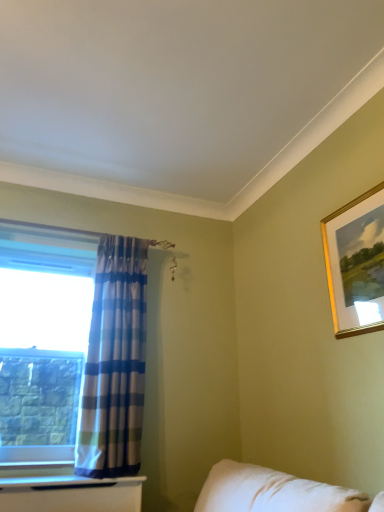
What do you see at coordinates (356, 263) in the screenshot?
I see `gold-framed picture at upper right` at bounding box center [356, 263].

Locate an element on the screen. Image resolution: width=384 pixels, height=512 pixels. clear glass window at left is located at coordinates (72, 348).

What is the approximate width of clear glass window at left?

The width of clear glass window at left is 6.29 inches.

Identify the location of blue plaid fabric curtain at left. (114, 362).

Considering the relative sizes of gold-framed picture at upper right and blue plaid fabric curtain at left in the image provided, is gold-framed picture at upper right smaller than blue plaid fabric curtain at left?

Correct, gold-framed picture at upper right occupies less space than blue plaid fabric curtain at left.

How distant is gold-framed picture at upper right from blue plaid fabric curtain at left?

The distance of gold-framed picture at upper right from blue plaid fabric curtain at left is 3.97 feet.

Is blue plaid fabric curtain at left located within gold-framed picture at upper right?

No, blue plaid fabric curtain at left is not surrounded by gold-framed picture at upper right.

Is the position of blue plaid fabric curtain at left more distant than that of gold-framed picture at upper right?

Yes.

Does blue plaid fabric curtain at left have a greater height compared to gold-framed picture at upper right?

Yes, blue plaid fabric curtain at left is taller than gold-framed picture at upper right.

Can you tell me how much blue plaid fabric curtain at left and gold-framed picture at upper right differ in facing direction?

The angle between the facing direction of blue plaid fabric curtain at left and the facing direction of gold-framed picture at upper right is 90.6 degrees.

From the image's perspective, does blue plaid fabric curtain at left appear lower than gold-framed picture at upper right?

Indeed, from the image's perspective, blue plaid fabric curtain at left is shown beneath gold-framed picture at upper right.

Can clear glass window at left be found inside gold-framed picture at upper right?

No, clear glass window at left is not inside gold-framed picture at upper right.

Consider the image. Is clear glass window at left at the back of gold-framed picture at upper right?

No, clear glass window at left is not at the back of gold-framed picture at upper right.

Would you consider gold-framed picture at upper right to be distant from clear glass window at left?

Absolutely, gold-framed picture at upper right is distant from clear glass window at left.

Does gold-framed picture at upper right have a lesser width compared to clear glass window at left?

Yes.

From a real-world perspective, which is physically above, blue plaid fabric curtain at left or clear glass window at left?

clear glass window at left, from a real-world perspective.

Is blue plaid fabric curtain at left far from clear glass window at left?

They are positioned close to each other.

Does point (133, 411) appear closer or farther from the camera than point (105, 295)?

Point (133, 411) is closer to the camera than point (105, 295).

Is blue plaid fabric curtain at left positioned with its back to clear glass window at left?

No, clear glass window at left is not at the back of blue plaid fabric curtain at left.

Do you think clear glass window at left is within blue plaid fabric curtain at left, or outside of it?

clear glass window at left is not enclosed by blue plaid fabric curtain at left.

Which of these two, clear glass window at left or blue plaid fabric curtain at left, is smaller?

With smaller size is blue plaid fabric curtain at left.

Is clear glass window at left placed right next to blue plaid fabric curtain at left?

clear glass window at left and blue plaid fabric curtain at left are not in contact.

Looking at this image, how distant is clear glass window at left from gold-framed picture at upper right?

They are 1.39 meters apart.

Between point (119, 463) and point (350, 327), which one is positioned behind?

The point (119, 463) is farther.

You are a GUI agent. You are given a task and a screenshot of the screen. Output one action in this format:
    pyautogui.click(x=<x>, y=<y>)
    Task: Click on the window located on the left of gold-framed picture at upper right
    The height and width of the screenshot is (512, 384).
    Given the screenshot: What is the action you would take?
    pyautogui.click(x=72, y=348)

Which of these two, clear glass window at left or gold-framed picture at upper right, is bigger?

clear glass window at left.

What are the coordinates of `picture frame lying on the right of blue plaid fabric curtain at left` in the screenshot? It's located at (356, 263).

Where is `picture frame located above the blue plaid fabric curtain at left (from the image's perspective)`? picture frame located above the blue plaid fabric curtain at left (from the image's perspective) is located at coordinates pos(356,263).

Based on their spatial positions, is clear glass window at left or gold-framed picture at upper right closer to blue plaid fabric curtain at left?

Based on the image, clear glass window at left appears to be nearer to blue plaid fabric curtain at left.

Based on their spatial positions, is blue plaid fabric curtain at left or clear glass window at left further from gold-framed picture at upper right?

clear glass window at left is further to gold-framed picture at upper right.

Looking at the image, which one is located further to gold-framed picture at upper right, clear glass window at left or blue plaid fabric curtain at left?

clear glass window at left lies further to gold-framed picture at upper right than the other object.

Which object lies nearer to the anchor point clear glass window at left, gold-framed picture at upper right or blue plaid fabric curtain at left?

blue plaid fabric curtain at left is positioned closer to the anchor clear glass window at left.

When comparing their distances from clear glass window at left, does blue plaid fabric curtain at left or gold-framed picture at upper right seem further?

gold-framed picture at upper right is positioned further to the anchor clear glass window at left.

Consider the image. Which object lies nearer to the anchor point blue plaid fabric curtain at left, gold-framed picture at upper right or clear glass window at left?

clear glass window at left is closer to blue plaid fabric curtain at left.

Where is `curtain situated between clear glass window at left and gold-framed picture at upper right from left to right`? Image resolution: width=384 pixels, height=512 pixels. curtain situated between clear glass window at left and gold-framed picture at upper right from left to right is located at coordinates (114, 362).